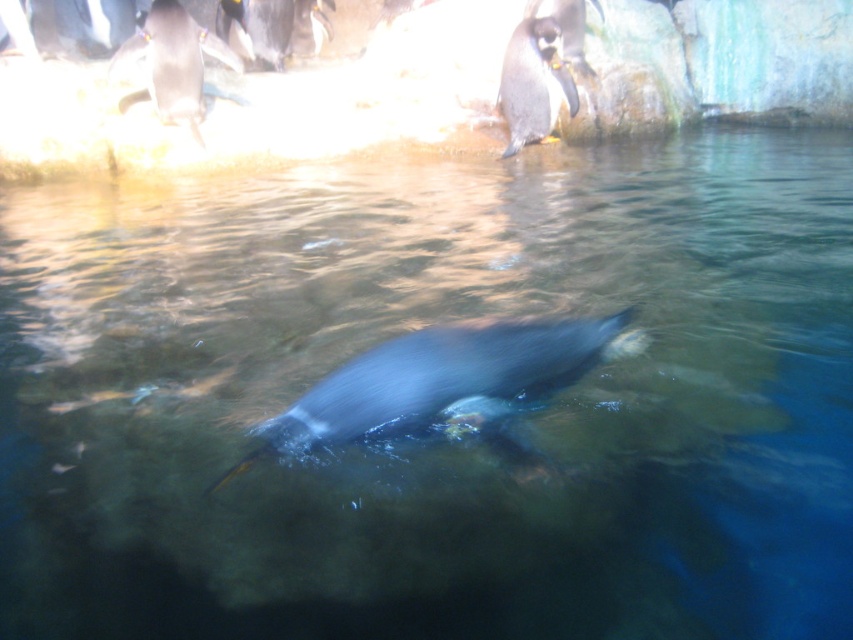
Is shiny black penguin at center wider than black matte penguin at upper center?

Yes.

Where is `shiny black penguin at center`? shiny black penguin at center is located at coordinates (440, 381).

Identify the location of shiny black penguin at center. (440, 381).

Is shiny black penguin at center wider than black glossy penguin at upper center?

Yes, shiny black penguin at center is wider than black glossy penguin at upper center.

Is shiny black penguin at center closer to camera compared to black glossy penguin at upper center?

Yes, it is.

What do you see at coordinates (440, 381) in the screenshot? I see `shiny black penguin at center` at bounding box center [440, 381].

Where is `shiny black penguin at center`? This screenshot has height=640, width=853. shiny black penguin at center is located at coordinates (440, 381).

Does point (151, 90) come farther from viewer compared to point (596, 1)?

No.

Between black glossy penguin at upper left and black glossy penguin at upper right, which one has less height?

black glossy penguin at upper right is shorter.

Is point (180, 26) positioned before point (581, 42)?

Yes, it is.

In order to click on black glossy penguin at upper left in this screenshot , I will do `click(173, 61)`.